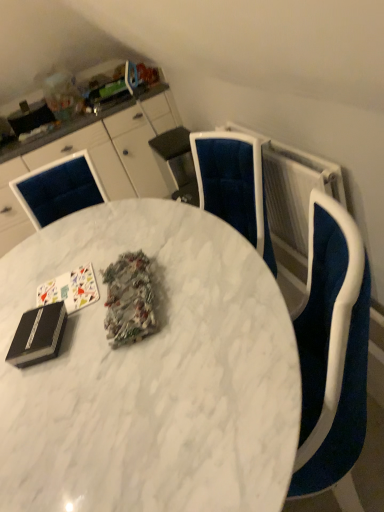
Find the location of a particular element. free spot behind shiny metallic foil at center is located at coordinates (98, 267).